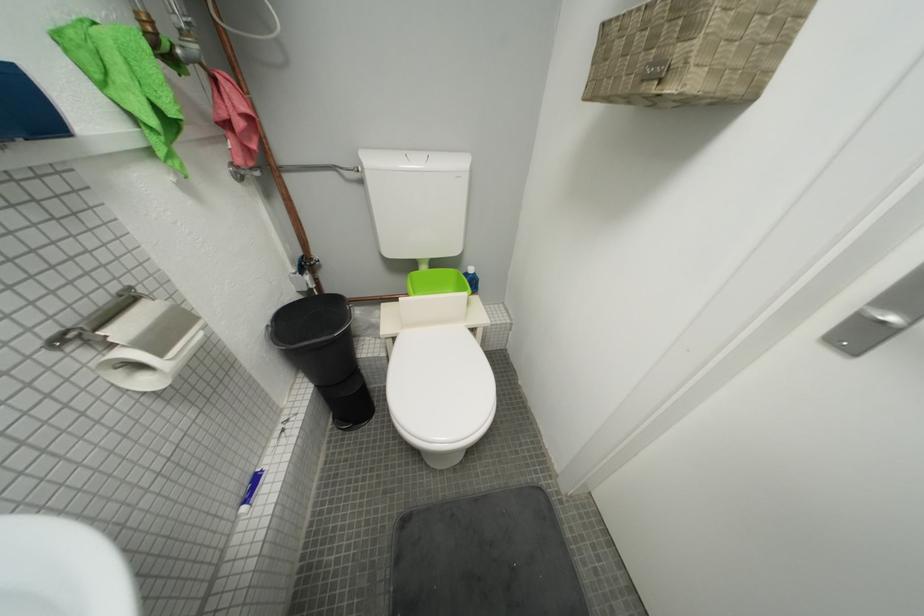
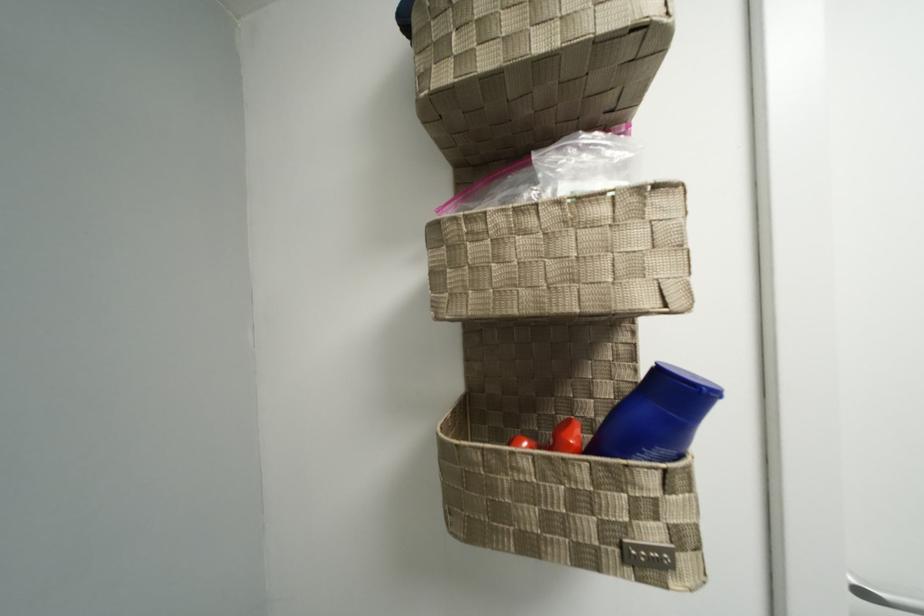
Question: The first image is from the beginning of the video and the second image is from the end. How did the camera likely rotate when shooting the video?

Choices:
 (A) Left
 (B) Right
 (C) Up
 (D) Down

Answer: (B)